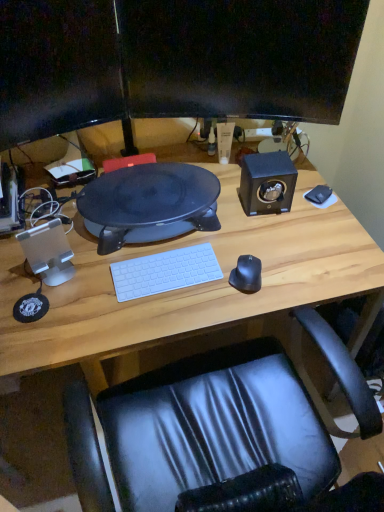
Identify the location of vacant space in between black matte mouse at right and white matte keyboard at center. (201, 288).